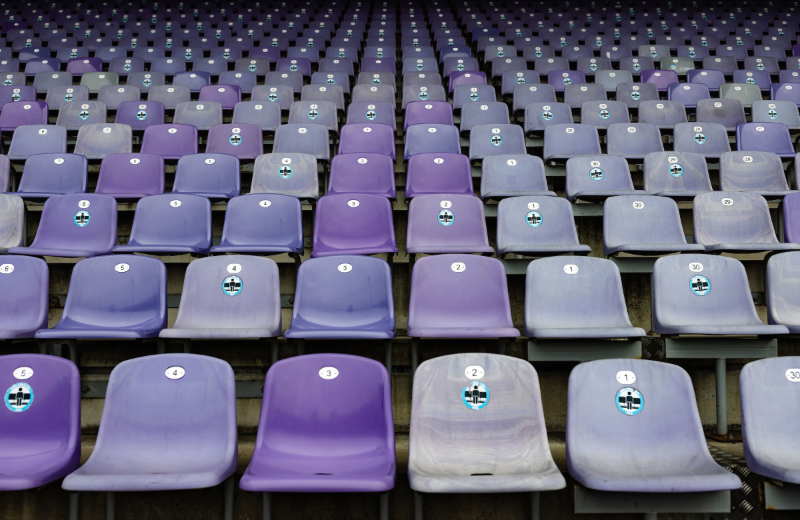
I want to click on seat number 1, so click(x=632, y=383), click(x=584, y=304), click(x=548, y=223), click(x=514, y=176).